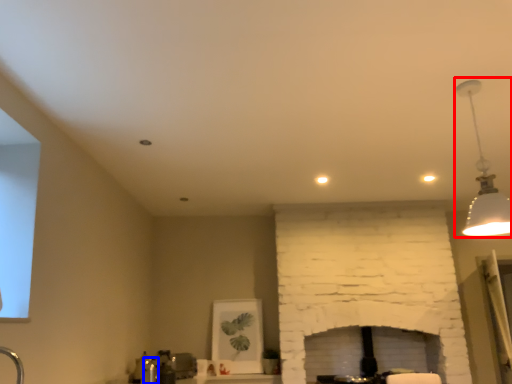
Question: Among these objects, which one is farthest to the camera, lamp (highlighted by a red box) or faucet (highlighted by a blue box)?

Choices:
 (A) lamp
 (B) faucet

Answer: (B)